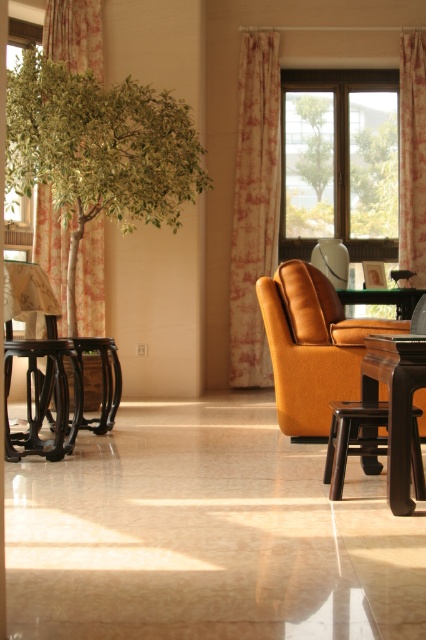
Question: Which object appears closest to the camera in this image?

Choices:
 (A) matte orange armchair at center
 (B) transparent glass window at upper left
 (C) floral fabric curtain at left
 (D) floral fabric curtain at upper right

Answer: (A)

Question: Based on their relative distances, which object is farther from the wooden table at center?

Choices:
 (A) dark brown wooden stool at lower right
 (B) floral fabric curtain at left
 (C) dark brown wooden table at lower right

Answer: (C)

Question: Which point is farther to the camera?

Choices:
 (A) (330, 445)
 (B) (290, 90)
 (C) (417, 90)

Answer: (B)

Question: Does transparent glass window at upper center appear on the right side of floral fabric curtain at left?

Choices:
 (A) yes
 (B) no

Answer: (A)

Question: Observing the image, what is the correct spatial positioning of matte orange armchair at center in reference to floral fabric curtain at upper right?

Choices:
 (A) right
 (B) left

Answer: (B)

Question: Does beige floral curtain at center have a lesser width compared to floral fabric curtain at upper right?

Choices:
 (A) yes
 (B) no

Answer: (B)